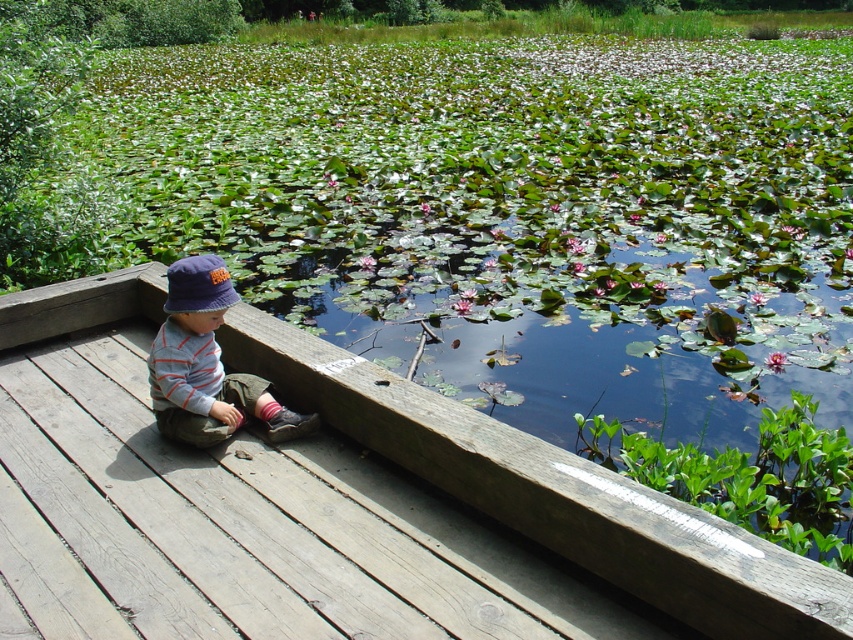
Is striped cotton shirt at left below blue fabric hat at left?

Correct, striped cotton shirt at left is located below blue fabric hat at left.

Which of these two, striped cotton shirt at left or blue fabric hat at left, stands taller?

striped cotton shirt at left is taller.

At what (x,y) coordinates should I click in order to perform the action: click on striped cotton shirt at left. Please return your answer as a coordinate pair (x, y). Looking at the image, I should click on (207, 365).

Can you confirm if wooden deck at center is wider than striped cotton shirt at left?

Yes.

Is point (335, 403) closer to viewer compared to point (167, 368)?

No.

Does point (494, 433) come farther from viewer compared to point (158, 372)?

No.

This screenshot has width=853, height=640. Find the location of `wooden deck at center`. wooden deck at center is located at coordinates (553, 493).

Is wooden deck at center to the right of blue fabric hat at left from the viewer's perspective?

Correct, you'll find wooden deck at center to the right of blue fabric hat at left.

The width and height of the screenshot is (853, 640). Describe the element at coordinates (553, 493) in the screenshot. I see `wooden deck at center` at that location.

What do you see at coordinates (553, 493) in the screenshot?
I see `wooden deck at center` at bounding box center [553, 493].

I want to click on wooden deck at center, so click(553, 493).